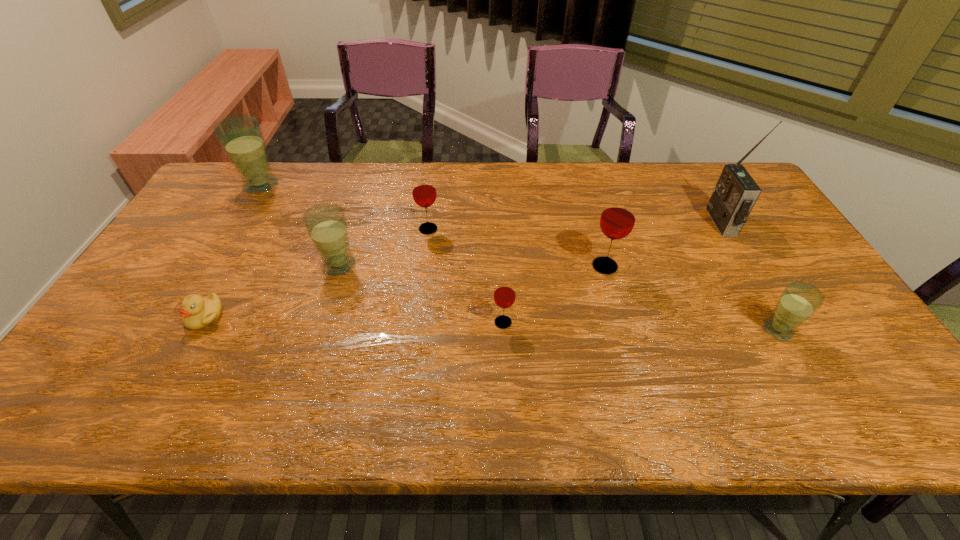
This screenshot has width=960, height=540. I want to click on vacant space situated on the front of the second smallest red glass, so click(421, 285).

Where is `vacant region located on the back of the second farthest blue glass`? vacant region located on the back of the second farthest blue glass is located at coordinates (354, 216).

You are a GUI agent. You are given a task and a screenshot of the screen. Output one action in this format:
    pyautogui.click(x=<x>, y=<y>)
    Task: Click on the free space located 0.260m on the left of the rightmost blue glass
    Image resolution: width=960 pixels, height=540 pixels.
    Given the screenshot: What is the action you would take?
    pyautogui.click(x=657, y=330)

The image size is (960, 540). In order to click on free region located on the front of the fifth object from left to right in this screenshot , I will do `click(507, 397)`.

Where is `vacant region located on the front-facing side of the shortest object`? This screenshot has height=540, width=960. vacant region located on the front-facing side of the shortest object is located at coordinates (181, 359).

Find the location of a particular element. This screenshot has width=960, height=540. object present at the far edge is located at coordinates (241, 137).

Where is `object located at the left edge`? Image resolution: width=960 pixels, height=540 pixels. object located at the left edge is located at coordinates (241, 137).

Where is `radio receiver at the right edge`? The image size is (960, 540). radio receiver at the right edge is located at coordinates (735, 194).

You are a GUI agent. You are given a task and a screenshot of the screen. Output one action in this format:
    pyautogui.click(x=<x>, y=<y>)
    Task: Click on the glass that is positioned at the right edge
    The image size is (960, 540).
    Given the screenshot: What is the action you would take?
    pyautogui.click(x=799, y=300)

You are a GUI agent. You are given a task and a screenshot of the screen. Output one action in this format:
    pyautogui.click(x=<x>, y=<y>)
    Task: Click on the object located in the far left corner section of the desktop
    The height and width of the screenshot is (540, 960).
    Given the screenshot: What is the action you would take?
    pyautogui.click(x=241, y=137)